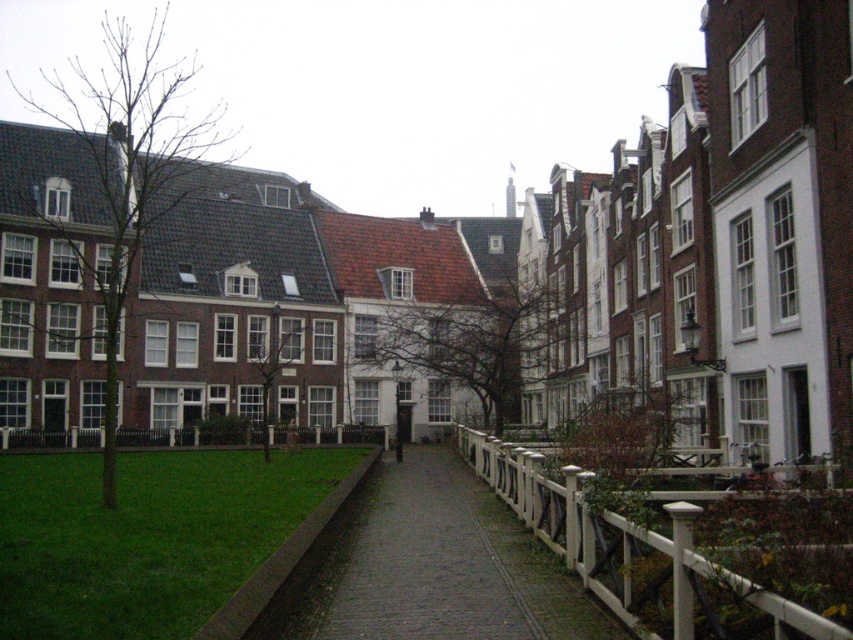
Question: Is green grass at lower left to the left of white wooden fence at lower right from the viewer's perspective?

Choices:
 (A) yes
 (B) no

Answer: (A)

Question: Which object is closer to the camera taking this photo?

Choices:
 (A) green grass at lower left
 (B) white wooden fence at lower right

Answer: (B)

Question: Is green grass at lower left to the right of white wooden fence at lower right from the viewer's perspective?

Choices:
 (A) no
 (B) yes

Answer: (A)

Question: Where is green grass at lower left located in relation to white wooden fence at lower right in the image?

Choices:
 (A) above
 (B) below

Answer: (B)